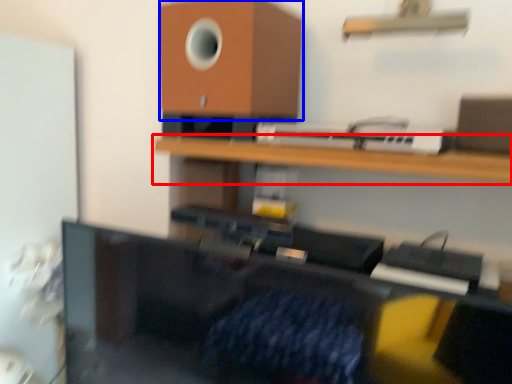
Question: Which point is further to the camera, shelf (highlighted by a red box) or speaker (highlighted by a blue box)?

Choices:
 (A) shelf
 (B) speaker

Answer: (B)